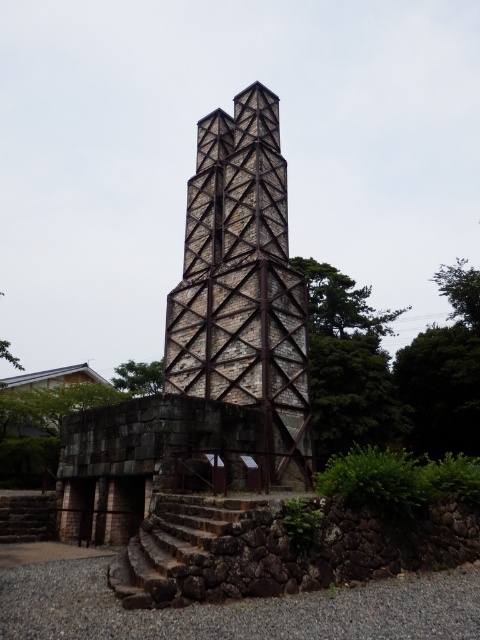
Does point (196, 500) come farther from viewer compared to point (141, 371)?

No, (196, 500) is in front of (141, 371).

Which is more to the left, brown stone stairs at lower center or green leafy tree at center?

From the viewer's perspective, green leafy tree at center appears more on the left side.

The width and height of the screenshot is (480, 640). In order to click on brown stone stairs at lower center in this screenshot , I will do `click(175, 540)`.

Locate an element on the screen. stone textured bell tower at center is located at coordinates (242, 284).

Locate an element on the screen. The image size is (480, 640). stone textured bell tower at center is located at coordinates (242, 284).

You are a GUI agent. You are given a task and a screenshot of the screen. Output one action in this format:
    pyautogui.click(x=<x>, y=<y>)
    Task: Click on the stone textured bell tower at center
    
    Given the screenshot: What is the action you would take?
    pyautogui.click(x=242, y=284)

Who is shorter, green leafy tree at upper center or green leafy tree at center?

With less height is green leafy tree at center.

What do you see at coordinates (342, 304) in the screenshot? I see `green leafy tree at upper center` at bounding box center [342, 304].

Find the location of a particular element. The width and height of the screenshot is (480, 640). green leafy tree at upper center is located at coordinates [x=342, y=304].